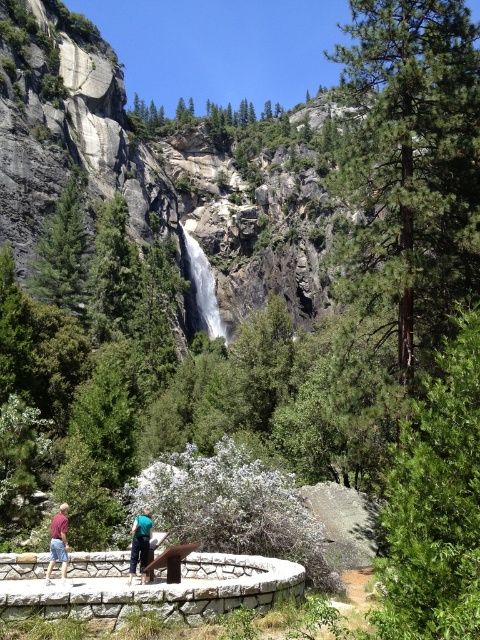
Question: In this image, where is white smooth waterfall at center located relative to green fabric shirt at center?

Choices:
 (A) above
 (B) below

Answer: (A)

Question: Does white smooth waterfall at center appear under green fabric shirt at center?

Choices:
 (A) no
 (B) yes

Answer: (A)

Question: Which object is closer to the camera taking this photo?

Choices:
 (A) maroon fabric shirt at lower left
 (B) white smooth waterfall at center
 (C) green fabric shirt at center

Answer: (A)

Question: Among these objects, which one is nearest to the camera?

Choices:
 (A) maroon fabric shirt at lower left
 (B) white smooth waterfall at center
 (C) green fabric shirt at center

Answer: (A)

Question: Which of these objects is positioned closest to the green fabric shirt at center?

Choices:
 (A) maroon fabric shirt at lower left
 (B) white smooth waterfall at center

Answer: (A)

Question: Is white smooth waterfall at center to the left of maroon fabric shirt at lower left from the viewer's perspective?

Choices:
 (A) no
 (B) yes

Answer: (A)